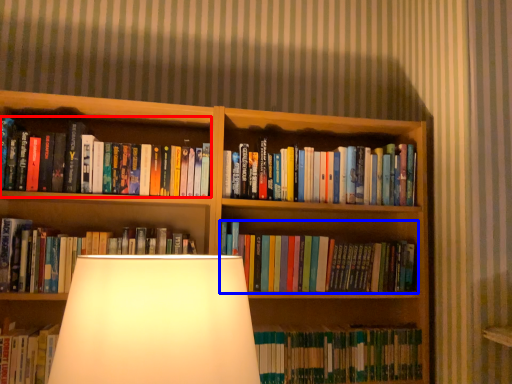
Question: Which of the following is the farthest to the observer, book (highlighted by a red box) or book (highlighted by a blue box)?

Choices:
 (A) book
 (B) book

Answer: (B)